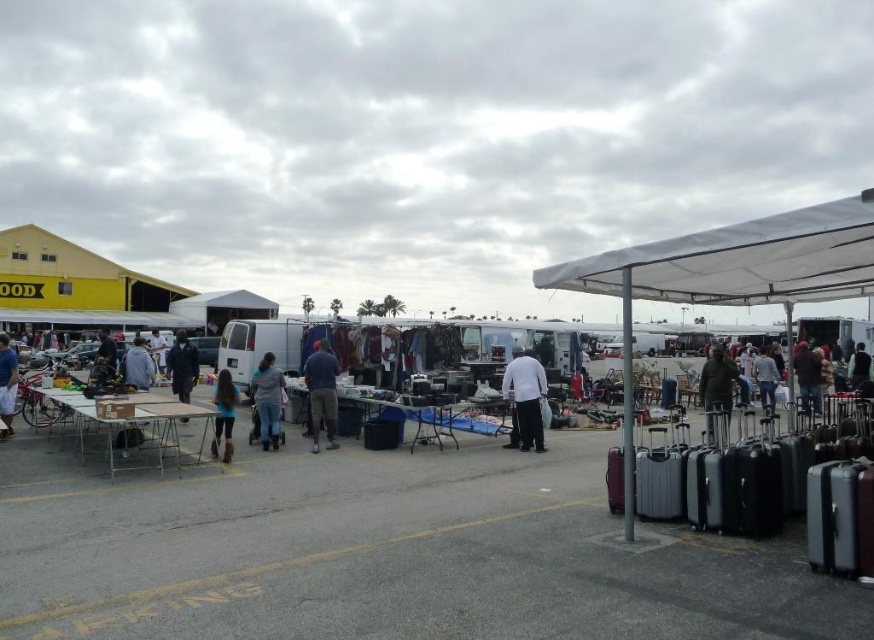
Is dark gray fabric jacket at center shorter than dark blue jeans at center?

In fact, dark gray fabric jacket at center may be taller than dark blue jeans at center.

Which is in front, point (857, 360) or point (109, 342)?

Point (109, 342) is more forward.

Where is `dark gray fabric jacket at center`? dark gray fabric jacket at center is located at coordinates (x=859, y=365).

Is denim pants at center smaller than dark blue jeans at lower right?

Indeed, denim pants at center has a smaller size compared to dark blue jeans at lower right.

Who is shorter, denim pants at center or dark blue jeans at lower right?

Standing shorter between the two is dark blue jeans at lower right.

Where is `denim pants at center`? denim pants at center is located at coordinates (267, 400).

How much distance is there between gray fabric jacket at center and jeans at center?

gray fabric jacket at center is 15.46 meters from jeans at center.

Who is taller, gray fabric jacket at center or jeans at center?

jeans at center is taller.

Between point (123, 371) and point (762, 380), which one is positioned in front?

Point (123, 371)

At what (x,y) coordinates should I click in order to perform the action: click on gray fabric jacket at center. Please return your answer as a coordinate pair (x, y). This screenshot has width=874, height=640. Looking at the image, I should click on (137, 365).